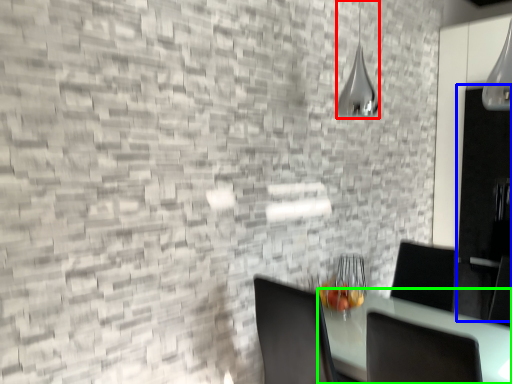
Question: Considering the real-world distances, which object is closest to lamp (highlighted by a red box)? glass door (highlighted by a blue box) or table (highlighted by a green box).

Choices:
 (A) glass door
 (B) table

Answer: (A)